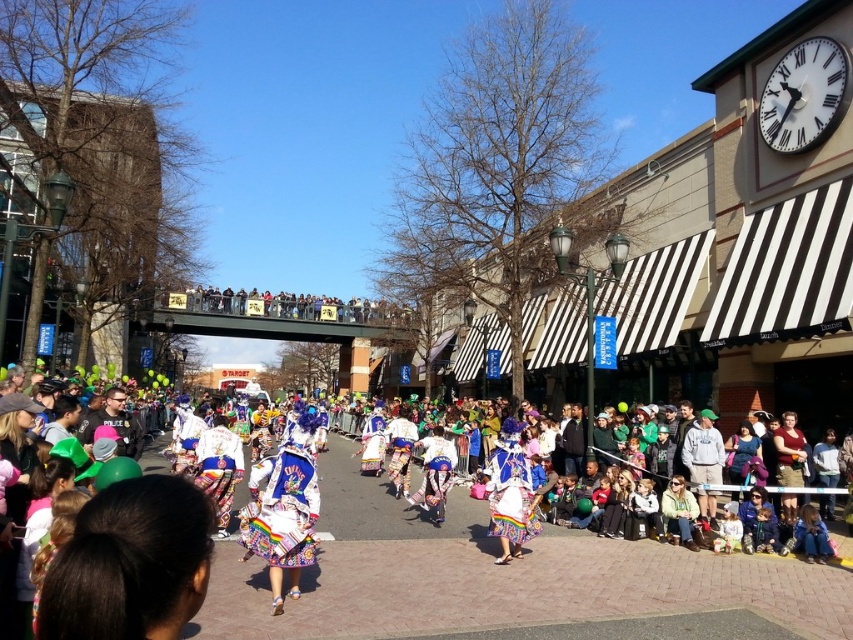
Between white satin dress at center and gray cotton hoodie at center, which one is positioned lower?

gray cotton hoodie at center is below.

Does white satin dress at center have a lesser height compared to gray cotton hoodie at center?

No.

What do you see at coordinates (283, 509) in the screenshot?
I see `white satin dress at center` at bounding box center [283, 509].

Where is `white satin dress at center`? white satin dress at center is located at coordinates (283, 509).

How much distance is there between colorful fabric dancers at center and colorful fabric dancer at center?

colorful fabric dancers at center and colorful fabric dancer at center are 4.33 meters apart.

Is colorful fabric dancers at center in front of colorful fabric dancer at center?

Yes, colorful fabric dancers at center is closer to the viewer.

Is point (459, 618) positioned behind point (498, 525)?

No, (459, 618) is closer to viewer.

Identify the location of colorful fabric dancers at center. (505, 579).

Between colorful fabric dancers at center and multicolored fabric skirt at center, which one is positioned lower?

colorful fabric dancers at center is lower down.

Does colorful fabric dancers at center have a smaller size compared to multicolored fabric skirt at center?

Actually, colorful fabric dancers at center might be larger than multicolored fabric skirt at center.

You are a GUI agent. You are given a task and a screenshot of the screen. Output one action in this format:
    pyautogui.click(x=<x>, y=<y>)
    Task: Click on the colorful fabric dancers at center
    
    Given the screenshot: What is the action you would take?
    pyautogui.click(x=505, y=579)